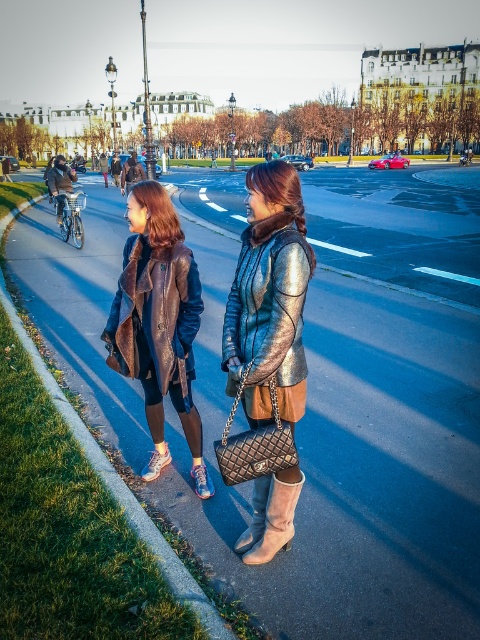
Does metallic silver jacket at center have a lesser width compared to brown leather jacket at left?

Indeed, metallic silver jacket at center has a lesser width compared to brown leather jacket at left.

Can you confirm if metallic silver jacket at center is taller than brown leather jacket at left?

No, metallic silver jacket at center is not taller than brown leather jacket at left.

Between point (249, 371) and point (176, 262), which one is positioned in front?

Point (249, 371)

Where is `metallic silver jacket at center`? metallic silver jacket at center is located at coordinates (269, 298).

Is metallic silver jacket at center taller than leather boot at lower center?

Indeed, metallic silver jacket at center has a greater height compared to leather boot at lower center.

Who is positioned more to the right, metallic silver jacket at center or leather boot at lower center?

Positioned to the right is metallic silver jacket at center.

I want to click on metallic silver jacket at center, so click(x=269, y=298).

Between smooth asphalt sidewalk at lower left and metallic silver jacket at center, which one is positioned lower?

Positioned lower is metallic silver jacket at center.

Is point (442, 512) less distant than point (299, 253)?

No, it is not.

The height and width of the screenshot is (640, 480). Find the location of `smooth asphalt sidewalk at lower left`. smooth asphalt sidewalk at lower left is located at coordinates (350, 465).